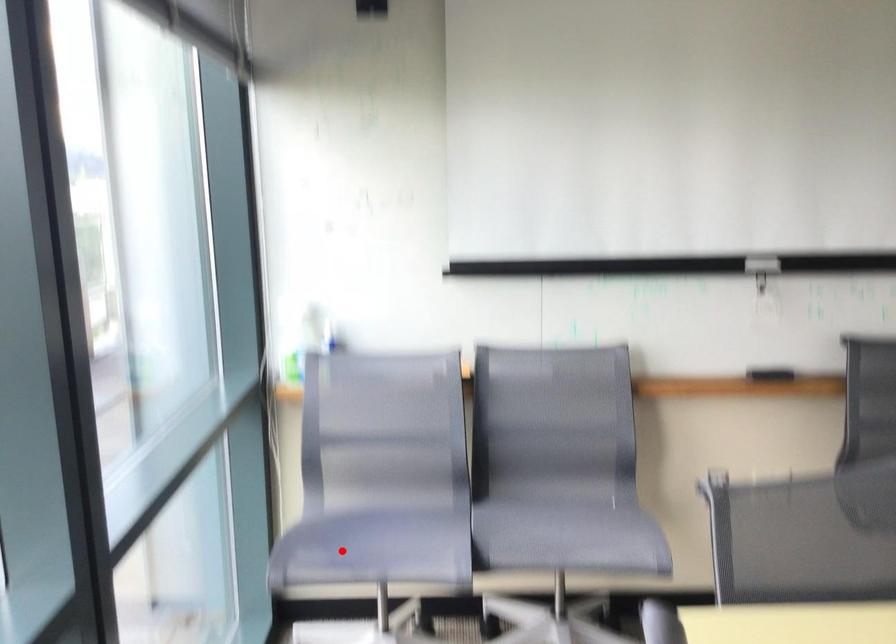
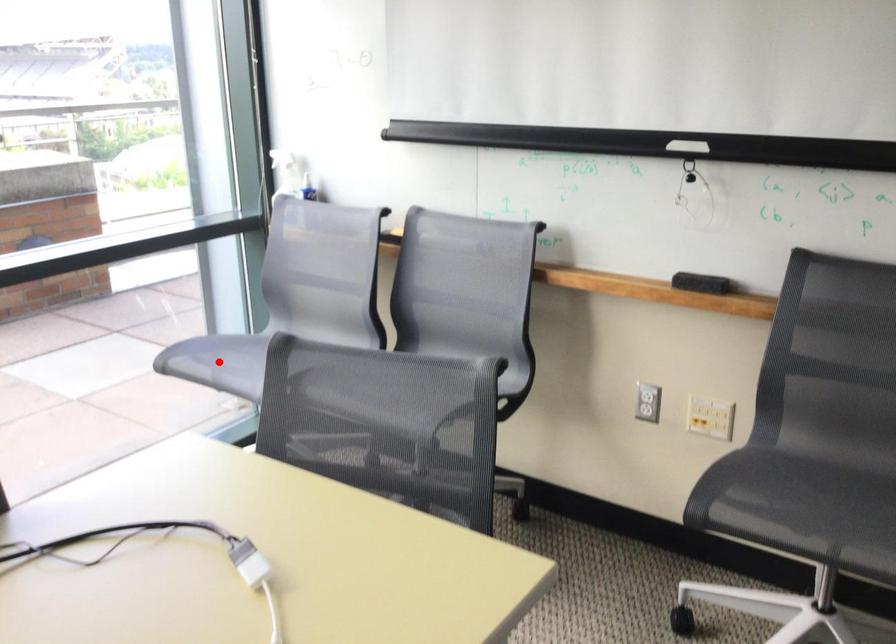
I am providing you with two images of the same scene from different viewpoints. A red point is marked on the first image and another point is marked on the second image. Are the points marked in image1 and image2 representing the same 3D position?

Yes